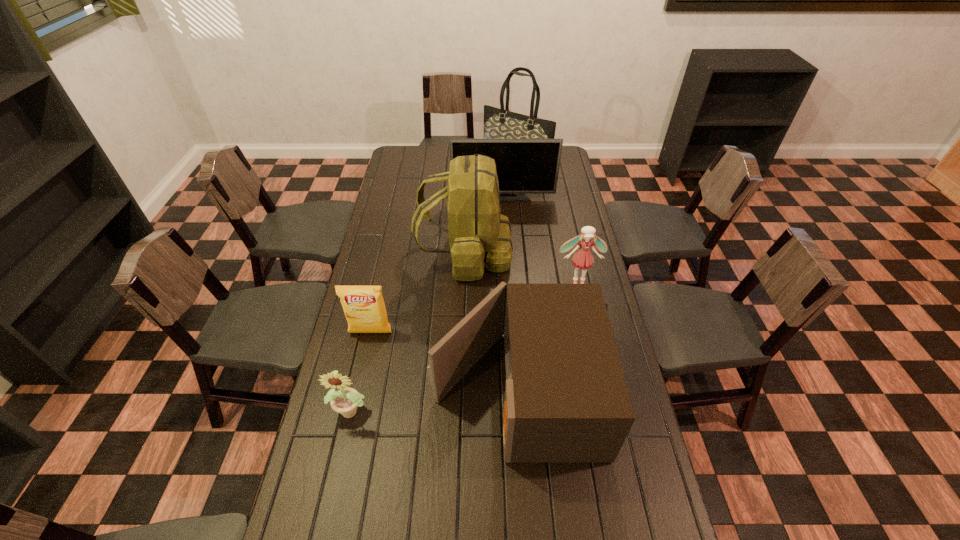
Where is `tote bag`? The height and width of the screenshot is (540, 960). tote bag is located at coordinates (498, 123).

I want to click on backpack, so click(479, 235).

The image size is (960, 540). I want to click on the sixth nearest object, so click(524, 166).

At what (x,y) coordinates should I click in order to perform the action: click on doll. Please return your answer as a coordinate pair (x, y). The image size is (960, 540). Looking at the image, I should click on (583, 259).

This screenshot has width=960, height=540. I want to click on microwave oven, so click(566, 400).

Image resolution: width=960 pixels, height=540 pixels. What are the coordinates of `crisp (potato chip)` in the screenshot? It's located at (364, 308).

Identify the location of sunflower. (345, 401).

The image size is (960, 540). I want to click on free space located on the front of the tote bag, so click(x=522, y=215).

You are a GUI agent. You are given a task and a screenshot of the screen. Output one action in this format:
    pyautogui.click(x=<x>, y=<y>)
    Task: Click on the vacant space located on the front-facing side of the backpack
    This screenshot has width=960, height=540.
    Given the screenshot: What is the action you would take?
    pyautogui.click(x=562, y=253)

Where is `free space located on the screen side of the second farthest object`? The height and width of the screenshot is (540, 960). free space located on the screen side of the second farthest object is located at coordinates (507, 251).